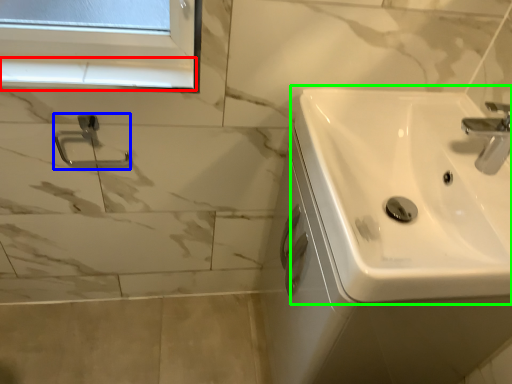
Question: Estimate the real-world distances between objects in this image. Which object is farther from window sill (highlighted by a red box), shower (highlighted by a blue box) or sink (highlighted by a green box)?

Choices:
 (A) shower
 (B) sink

Answer: (B)